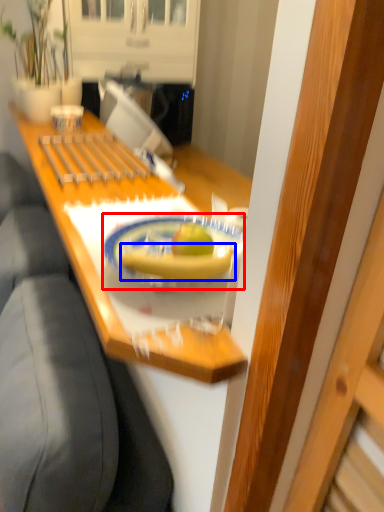
Question: Which of the following is the farthest to the observer, plate (highlighted by a red box) or banana (highlighted by a blue box)?

Choices:
 (A) plate
 (B) banana

Answer: (B)